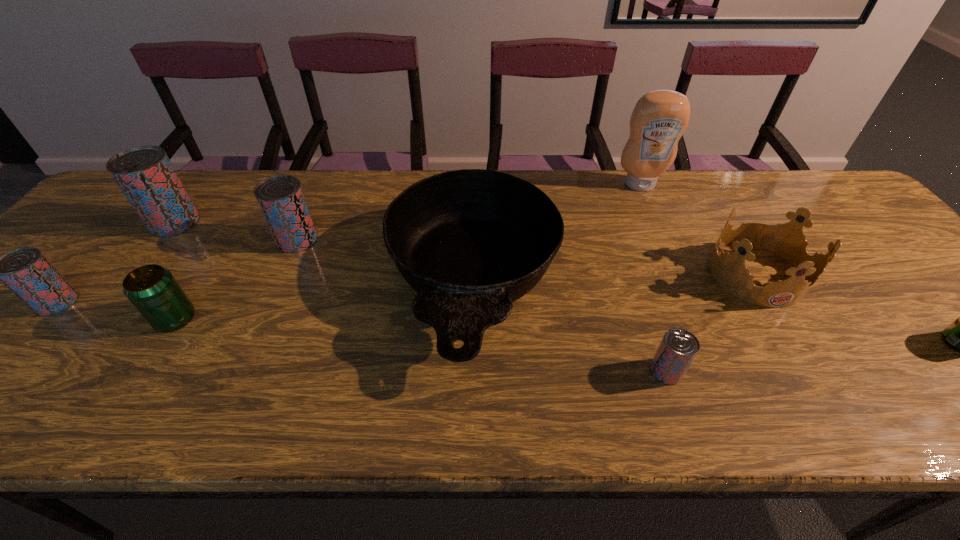
Where is `vacant space at the near edge of the desktop`? This screenshot has width=960, height=540. vacant space at the near edge of the desktop is located at coordinates (648, 418).

Find the location of a particular element. The height and width of the screenshot is (540, 960). vacant space at the far left corner is located at coordinates (116, 205).

Identify the location of free space between the second tallest object and the fifth object from right to left. (324, 253).

Find the location of a particular element. This screenshot has width=960, height=540. vacant space that is in between the fifth beer can from left to right and the eighth object from left to right is located at coordinates 710,322.

Locate an element on the screen. vacant region between the second beer can from right to left and the black frying pan is located at coordinates (570, 328).

Find the location of `free area in between the third farthest red beer can and the third object from right to left`. free area in between the third farthest red beer can and the third object from right to left is located at coordinates click(348, 244).

The width and height of the screenshot is (960, 540). I want to click on vacant point located between the leftmost object and the second beer can from right to left, so click(362, 336).

Find the location of a particular element. The height and width of the screenshot is (540, 960). free point between the frying pan and the tiara is located at coordinates (614, 279).

Identify which object is the eighth nearest to the condiment. Please provide its 2D coordinates. Your answer should be formatted as a tuple, i.e. [(x, y)], where the tuple contains the x and y coordinates of a point satisfying the conditions above.

[(25, 271)]

Select which object is the seventh closest to the smallest red beer can. Please provide its 2D coordinates. Your answer should be formatted as a tuple, i.e. [(x, y)], where the tuple contains the x and y coordinates of a point satisfying the conditions above.

[(145, 175)]